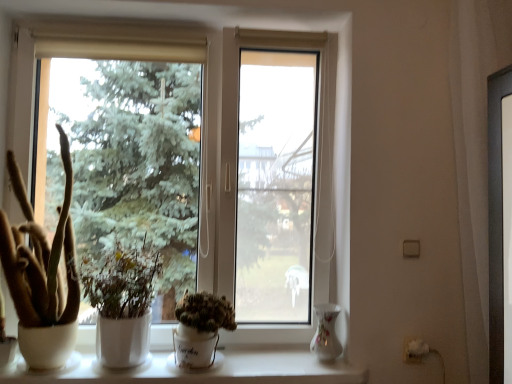
Question: Does brown fuzzy cactus at left, acting as the 3th houseplant starting from the right, have a lesser width compared to transparent glass window at center?

Choices:
 (A) yes
 (B) no

Answer: (B)

Question: Is brown fuzzy cactus at left, acting as the 3th houseplant starting from the right, placed right next to transparent glass window at center?

Choices:
 (A) no
 (B) yes

Answer: (A)

Question: Considering the relative sizes of brown fuzzy cactus at left, the 1th houseplant in the left-to-right sequence, and transparent glass window at center in the image provided, is brown fuzzy cactus at left, the 1th houseplant in the left-to-right sequence, smaller than transparent glass window at center?

Choices:
 (A) no
 (B) yes

Answer: (B)

Question: Does brown fuzzy cactus at left, the 1th houseplant in the left-to-right sequence, have a greater width compared to transparent glass window at center?

Choices:
 (A) no
 (B) yes

Answer: (B)

Question: Considering the relative positions of brown fuzzy cactus at left, acting as the 3th houseplant starting from the right, and transparent glass window at center in the image provided, is brown fuzzy cactus at left, acting as the 3th houseplant starting from the right, to the right of transparent glass window at center from the viewer's perspective?

Choices:
 (A) no
 (B) yes

Answer: (A)

Question: Is brown fuzzy cactus at left, acting as the 3th houseplant starting from the right, bigger than transparent glass window at center?

Choices:
 (A) yes
 (B) no

Answer: (B)

Question: Is porcelain floral vase at lower right positioned in front of white matte plant at center, which ranks as the 2th houseplant in right-to-left order?

Choices:
 (A) no
 (B) yes

Answer: (A)

Question: Considering the relative sizes of porcelain floral vase at lower right and white matte plant at center, the 2th houseplant positioned from the left, in the image provided, is porcelain floral vase at lower right smaller than white matte plant at center, the 2th houseplant positioned from the left,?

Choices:
 (A) yes
 (B) no

Answer: (A)

Question: Is white matte plant at center, which ranks as the 2th houseplant in right-to-left order, at the back of porcelain floral vase at lower right?

Choices:
 (A) yes
 (B) no

Answer: (B)

Question: Would you consider porcelain floral vase at lower right to be distant from white matte plant at center, which ranks as the 2th houseplant in right-to-left order?

Choices:
 (A) no
 (B) yes

Answer: (A)

Question: Can you confirm if porcelain floral vase at lower right is taller than white matte plant at center, which ranks as the 2th houseplant in right-to-left order?

Choices:
 (A) yes
 (B) no

Answer: (B)

Question: From a real-world perspective, is porcelain floral vase at lower right on white matte plant at center, the 2th houseplant positioned from the left?

Choices:
 (A) no
 (B) yes

Answer: (A)

Question: Is transparent glass window at center at the right side of white matte plant at center, which ranks as the 2th houseplant in right-to-left order?

Choices:
 (A) yes
 (B) no

Answer: (A)